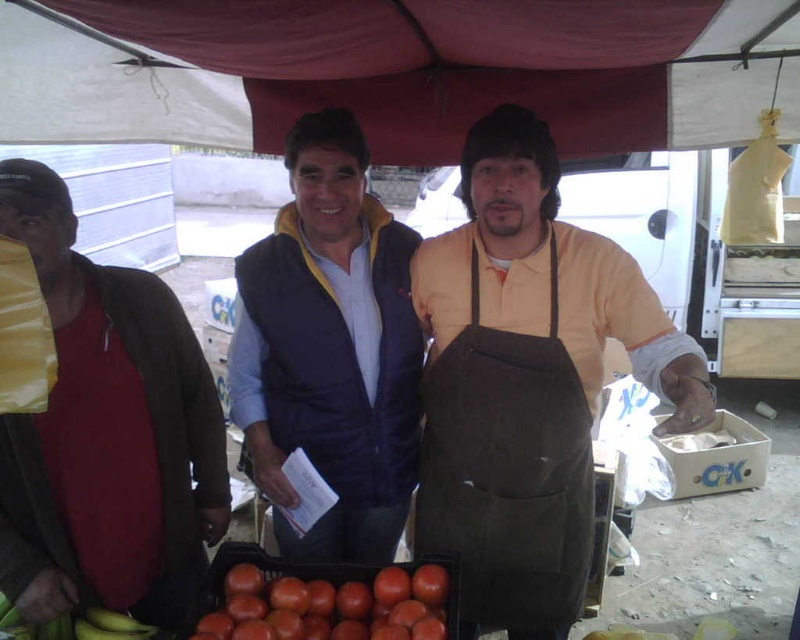
Is point (458, 584) behind point (314, 614)?

No, it is not.

Where is `brown canvas apron at center`? The height and width of the screenshot is (640, 800). brown canvas apron at center is located at coordinates (526, 381).

Who is more forward, (92, 333) or (397, 618)?

Positioned in front is point (397, 618).

Is red matte shirt at left bigger than shiny red tomatoes at center?

Indeed, red matte shirt at left has a larger size compared to shiny red tomatoes at center.

Is point (172, 310) farther from viewer compared to point (428, 618)?

Yes.

I want to click on red matte shirt at left, so click(106, 435).

Who is more forward, (528, 458) or (284, 308)?

Point (528, 458)

Who is positioned more to the left, brown canvas apron at center or velvet-like blue vest at center?

From the viewer's perspective, velvet-like blue vest at center appears more on the left side.

Between point (604, 285) and point (246, 452), which one is positioned in front?

Point (604, 285) is in front.

You are a GUI agent. You are given a task and a screenshot of the screen. Output one action in this format:
    pyautogui.click(x=<x>, y=<y>)
    Task: Click on the brown canvas apron at center
    
    Given the screenshot: What is the action you would take?
    pyautogui.click(x=526, y=381)